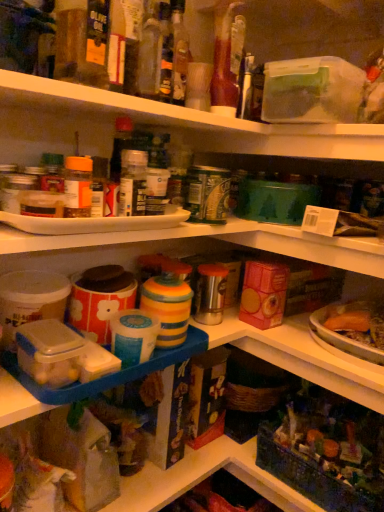
Question: Can you confirm if translucent glass bottle at center, which is the 2th bottle from right to left, is taller than translucent glass bottle at upper center, which is counted as the 3th bottle, starting from the right?

Choices:
 (A) yes
 (B) no

Answer: (A)

Question: Can we say translucent glass bottle at center, which is the 2th bottle from right to left, lies outside translucent glass bottle at upper center, which is counted as the 3th bottle, starting from the right?

Choices:
 (A) yes
 (B) no

Answer: (A)

Question: Is translucent glass bottle at center, positioned as the 3th bottle in left-to-right order, far from translucent glass bottle at upper center, the second bottle from the left?

Choices:
 (A) no
 (B) yes

Answer: (A)

Question: Is translucent glass bottle at center, which is the 2th bottle from right to left, placed right next to translucent glass bottle at upper center, the second bottle from the left?

Choices:
 (A) no
 (B) yes

Answer: (B)

Question: Is translucent glass bottle at center, which is the 2th bottle from right to left, to the right of translucent glass bottle at upper center, which is counted as the 3th bottle, starting from the right, from the viewer's perspective?

Choices:
 (A) no
 (B) yes

Answer: (B)

Question: Can you confirm if translucent glass bottle at center, which is the 2th bottle from right to left, is thinner than translucent glass bottle at upper center, which is counted as the 3th bottle, starting from the right?

Choices:
 (A) yes
 (B) no

Answer: (A)

Question: Is the position of translucent plastic container at lower right more distant than that of translucent glass bottle at center, which is the 2th bottle from right to left?

Choices:
 (A) yes
 (B) no

Answer: (B)

Question: From a real-world perspective, is translucent plastic container at lower right over translucent glass bottle at center, which is the 2th bottle from right to left?

Choices:
 (A) yes
 (B) no

Answer: (B)

Question: Can you confirm if translucent plastic container at lower right is bigger than translucent glass bottle at center, which is the 2th bottle from right to left?

Choices:
 (A) no
 (B) yes

Answer: (B)

Question: Considering the relative positions of translucent plastic container at lower right and translucent glass bottle at center, which is the 2th bottle from right to left, in the image provided, is translucent plastic container at lower right to the right of translucent glass bottle at center, which is the 2th bottle from right to left, from the viewer's perspective?

Choices:
 (A) yes
 (B) no

Answer: (A)

Question: Does translucent plastic container at lower right have a greater width compared to translucent glass bottle at center, positioned as the 3th bottle in left-to-right order?

Choices:
 (A) yes
 (B) no

Answer: (A)

Question: Does translucent plastic container at lower right have a smaller size compared to translucent glass bottle at center, positioned as the 3th bottle in left-to-right order?

Choices:
 (A) yes
 (B) no

Answer: (B)

Question: Does translucent glass bottle at upper center, which is counted as the 3th bottle, starting from the right, have a greater width compared to translucent plastic container at lower right?

Choices:
 (A) no
 (B) yes

Answer: (A)